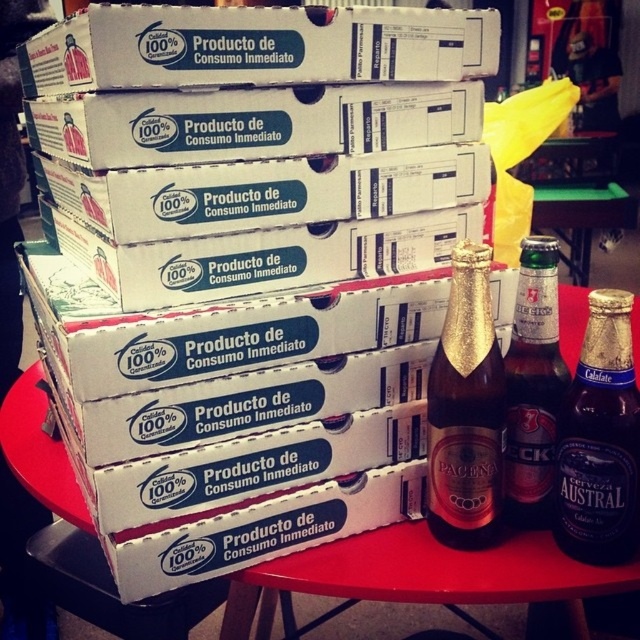
Does point (449, 486) lie behind point (564, 522)?

Yes, point (449, 486) is farther from viewer.

Who is shorter, gold foil beer bottle at center or dark glass bottle at center right?

dark glass bottle at center right is shorter.

Which is behind, point (452, 326) or point (620, 308)?

The point (452, 326) is more distant.

You are a GUI agent. You are given a task and a screenshot of the screen. Output one action in this format:
    pyautogui.click(x=<x>, y=<y>)
    Task: Click on the gold foil beer bottle at center
    The image size is (640, 640).
    Given the screenshot: What is the action you would take?
    pyautogui.click(x=465, y=410)

Which is in front, point (481, 481) or point (520, 445)?

Positioned in front is point (481, 481).

This screenshot has width=640, height=640. Describe the element at coordinates (465, 410) in the screenshot. I see `gold foil beer bottle at center` at that location.

At what (x,y) coordinates should I click in order to perform the action: click on gold foil beer bottle at center. Please return your answer as a coordinate pair (x, y). Image resolution: width=640 pixels, height=640 pixels. Looking at the image, I should click on (465, 410).

Where is `gold foil beer bottle at center`? This screenshot has width=640, height=640. gold foil beer bottle at center is located at coordinates (465, 410).

Does dark glass bottle at center right have a lesser width compared to green glass bottle at center right?

No.

Can you confirm if dark glass bottle at center right is bigger than green glass bottle at center right?

Yes.

Where is `dark glass bottle at center right`? Image resolution: width=640 pixels, height=640 pixels. dark glass bottle at center right is located at coordinates (600, 440).

Where is `dark glass bottle at center right`? This screenshot has height=640, width=640. dark glass bottle at center right is located at coordinates (600, 440).